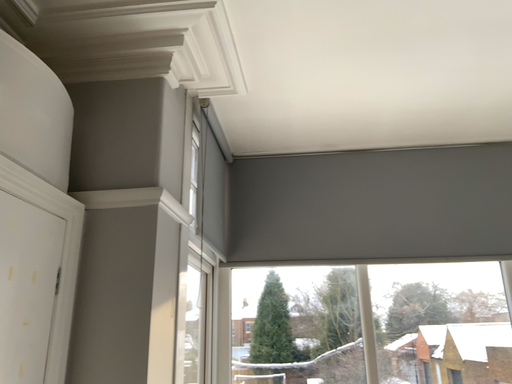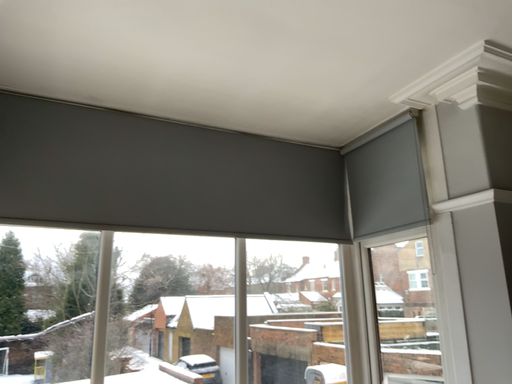
Question: How did the camera likely rotate when shooting the video?

Choices:
 (A) rotated right
 (B) rotated left

Answer: (A)